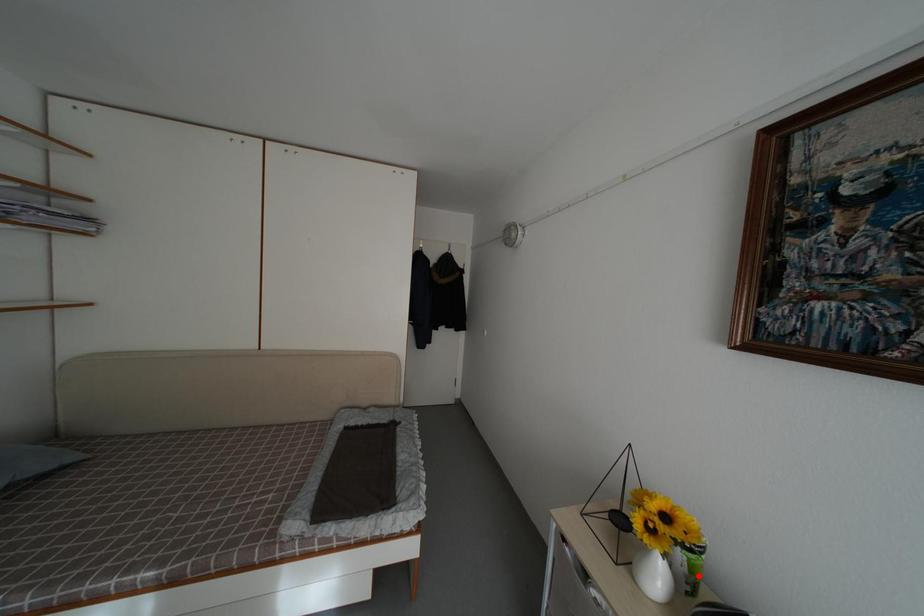
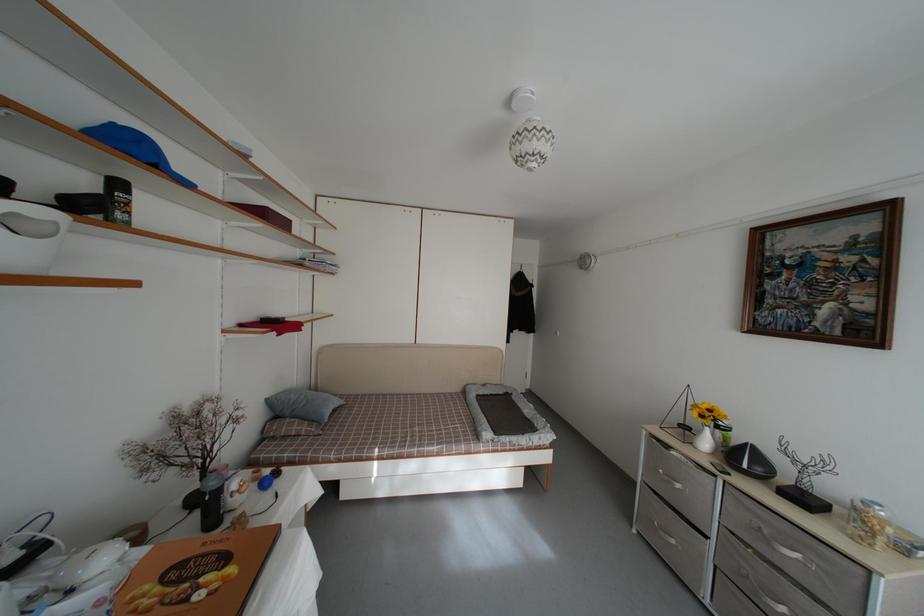
Locate, in the second image, the point that corresponds to the highlighted location in the first image.

(731, 446)